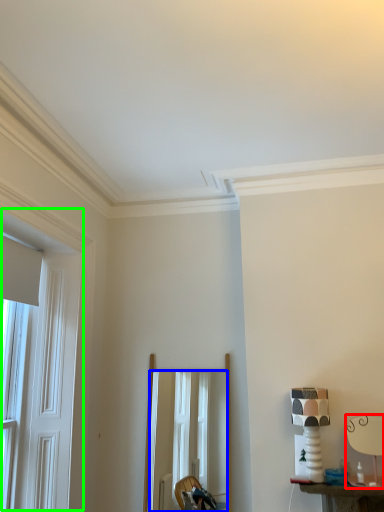
Question: Considering the real-world distances, which object is farthest from table lamp (highlighted by a red box)? mirror (highlighted by a blue box) or window (highlighted by a green box)?

Choices:
 (A) mirror
 (B) window

Answer: (B)